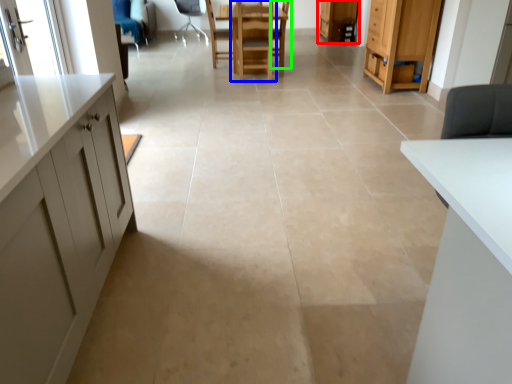
Question: Considering the real-world distances, which object is closest to cabinetry (highlighted by a red box)? chair (highlighted by a blue box) or armchair (highlighted by a green box).

Choices:
 (A) chair
 (B) armchair

Answer: (B)